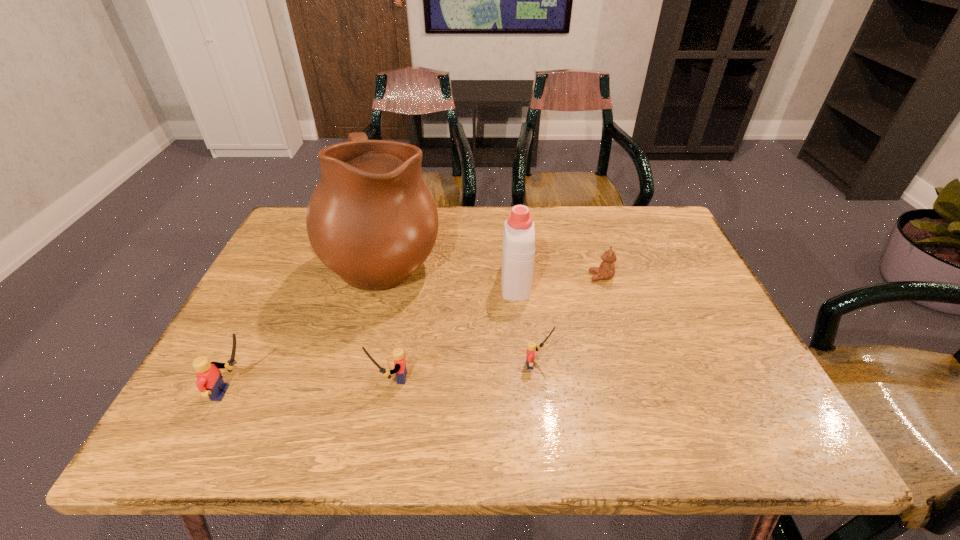
Where is `the leftmost object`? the leftmost object is located at coordinates (210, 382).

Locate an element on the screen. This screenshot has height=540, width=960. the fourth shortest object is located at coordinates (210, 382).

Find the location of a particular element. the second shortest Lego is located at coordinates (400, 370).

Image resolution: width=960 pixels, height=540 pixels. Find the location of `the second Lego from right to left`. the second Lego from right to left is located at coordinates (400, 370).

Identify the location of the rightmost Lego. Image resolution: width=960 pixels, height=540 pixels. coord(531,346).

Where is `cream pitcher`? This screenshot has width=960, height=540. cream pitcher is located at coordinates (371, 219).

Locate an element on the screen. The height and width of the screenshot is (540, 960). the second tallest object is located at coordinates (518, 249).

The width and height of the screenshot is (960, 540). In order to click on the rightmost object in this screenshot , I will do `click(606, 270)`.

What are the coordinates of `vacant region located on the front-facing side of the third tallest object` in the screenshot? It's located at (408, 393).

You are a GUI agent. You are given a task and a screenshot of the screen. Output one action in this format:
    pyautogui.click(x=<x>, y=<y>)
    Task: Click on the free space located on the front-facing side of the second shortest Lego
    
    Given the screenshot: What is the action you would take?
    pyautogui.click(x=202, y=378)